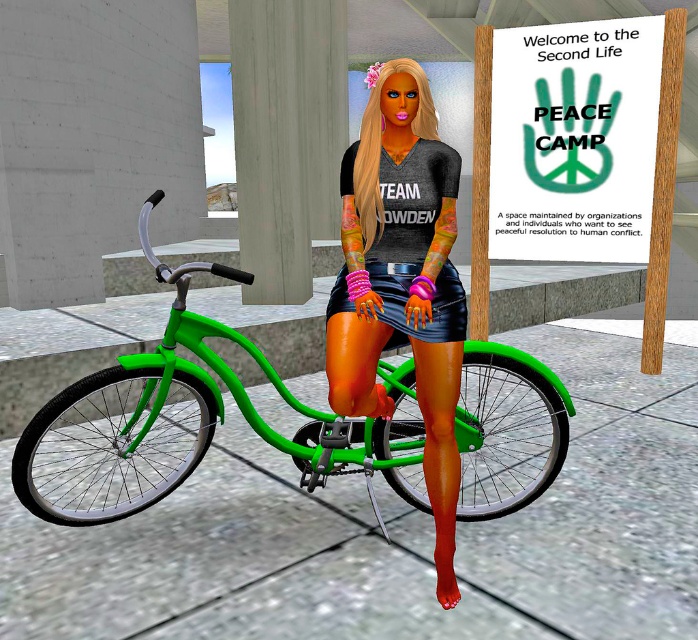
Who is more distant from viewer, (246, 276) or (438, 291)?

The point (438, 291) is behind.

Between point (70, 435) and point (406, 268), which one is positioned behind?

The point (70, 435) is more distant.

The image size is (698, 640). Find the location of `green matte bicycle at center`. green matte bicycle at center is located at coordinates (184, 424).

Who is taller, wooden signboard at upper right or black leather shorts at center?

wooden signboard at upper right

Between wooden signboard at upper right and black leather shorts at center, which one appears on the right side from the viewer's perspective?

wooden signboard at upper right is more to the right.

Which is behind, point (572, 54) or point (417, 273)?

Point (572, 54)

This screenshot has height=640, width=698. In order to click on wooden signboard at upper right in this screenshot , I will do `click(574, 140)`.

Looking at this image, can you confirm if matte black shirt at center is positioned to the right of wooden signboard at upper right?

No, matte black shirt at center is not to the right of wooden signboard at upper right.

Measure the distance between matte black shirt at center and camera.

The distance of matte black shirt at center from camera is 5.94 feet.

Describe the element at coordinates (401, 282) in the screenshot. The width and height of the screenshot is (698, 640). I see `matte black shirt at center` at that location.

Where is `matte black shirt at center`? The image size is (698, 640). matte black shirt at center is located at coordinates (401, 282).